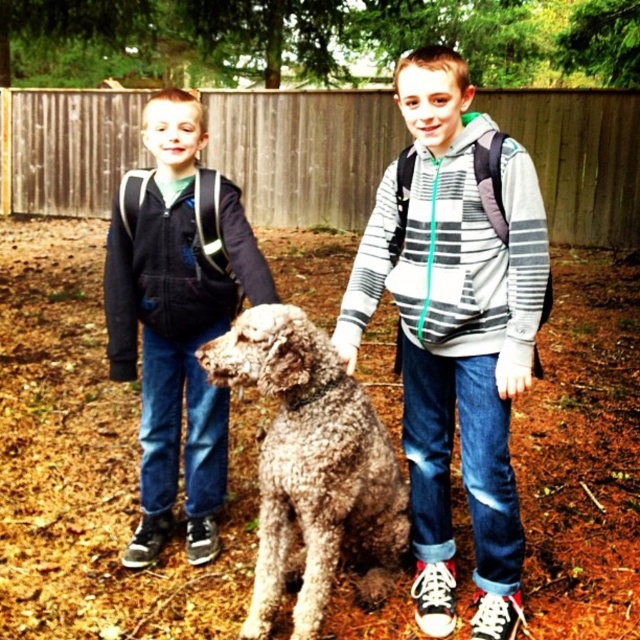
In the scene shown: Who is lower down, matte black hoodie at left or fuzzy brown dog at center?

fuzzy brown dog at center is below.

Is matte black hoodie at left above fuzzy brown dog at center?

Yes, matte black hoodie at left is above fuzzy brown dog at center.

Which is in front, point (214, 237) or point (291, 406)?

Point (291, 406)

The image size is (640, 640). In order to click on matte black hoodie at left in this screenshot , I will do `click(177, 317)`.

Does striped hoodie at center have a lesser width compared to matte black hoodie at left?

Indeed, striped hoodie at center has a lesser width compared to matte black hoodie at left.

Is striped hoodie at center below matte black hoodie at left?

Indeed, striped hoodie at center is positioned under matte black hoodie at left.

Between point (493, 451) and point (220, 202), which one is positioned in front?

Point (493, 451) is more forward.

Identify the location of striped hoodie at center. (456, 330).

Can you confirm if striped hoodie at center is taller than fuzzy brown dog at center?

Indeed, striped hoodie at center has a greater height compared to fuzzy brown dog at center.

Is striped hoodie at center thinner than fuzzy brown dog at center?

Correct, striped hoodie at center's width is less than fuzzy brown dog at center's.

This screenshot has height=640, width=640. What do you see at coordinates (456, 330) in the screenshot? I see `striped hoodie at center` at bounding box center [456, 330].

Locate an element on the screen. striped hoodie at center is located at coordinates (456, 330).